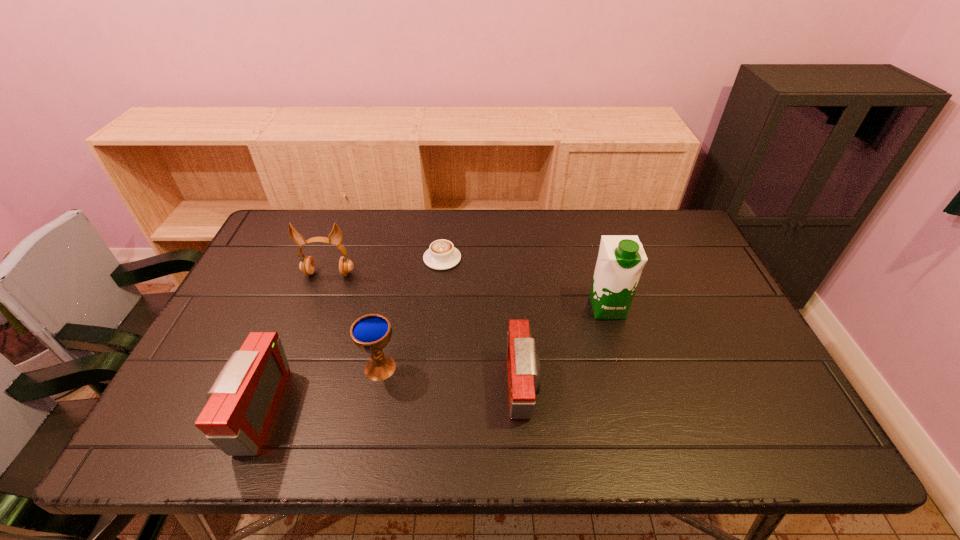
Image resolution: width=960 pixels, height=540 pixels. Identify the location of vacant point located on the front-facing side of the left camera. (203, 411).

The height and width of the screenshot is (540, 960). Identify the location of free space located 0.160m on the front-facing side of the left camera. (167, 411).

At what (x,y) coordinates should I click in order to perform the action: click on free space located on the front-facing side of the shorter camera. Please return your answer as a coordinate pair (x, y). The width and height of the screenshot is (960, 540). Looking at the image, I should click on (571, 387).

Locate an element on the screen. The image size is (960, 540). vacant space located with the handle on the right side of the third object from right to left is located at coordinates (444, 235).

Identify the location of vacant region located 0.060m with the handle on the right side of the third object from right to left. (444, 235).

Identify the location of vacant space located with the handle on the right side of the third object from right to left. (445, 227).

Locate an element on the screen. Image resolution: width=960 pixels, height=540 pixels. free space located on the front-facing side of the earphone is located at coordinates (284, 395).

Locate an element on the screen. The image size is (960, 540). free space located 0.110m on the back of the chalice is located at coordinates (390, 320).

At what (x,y) coordinates should I click in order to perform the action: click on free spot located on the front-facing side of the rightmost object. Please return your answer as a coordinate pair (x, y). The image size is (960, 540). Looking at the image, I should click on (615, 337).

Find the location of a particular element. This screenshot has height=540, width=960. object present at the far edge is located at coordinates (442, 255).